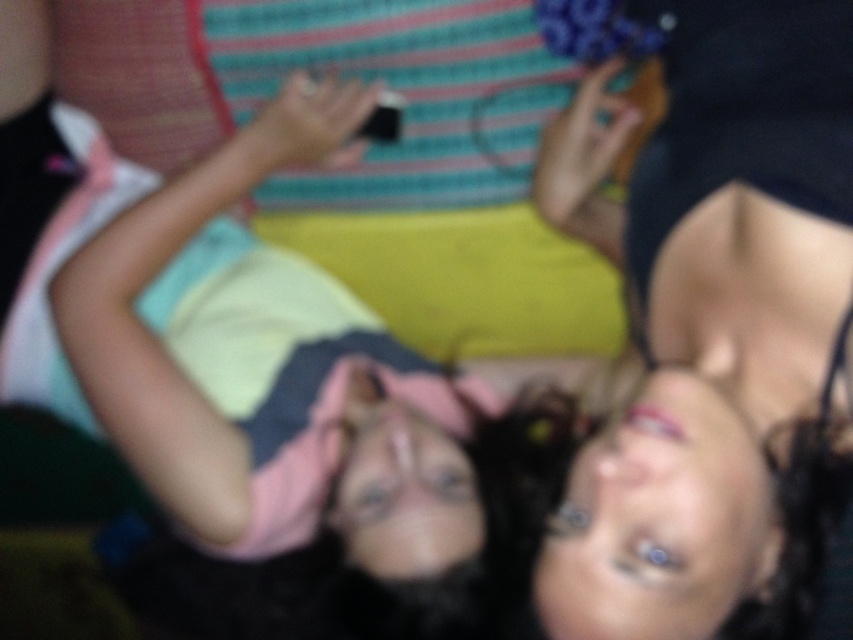
From the picture: Based on the scene description, where is the smooth skin face at upper center located in terms of coordinates?

The smooth skin face at upper center is located at coordinates point (720, 180).

Based on the scene description, which object is shorter between the smooth skin face at upper center and the pink fabric at center?

The smooth skin face at upper center is shorter than the pink fabric at center.